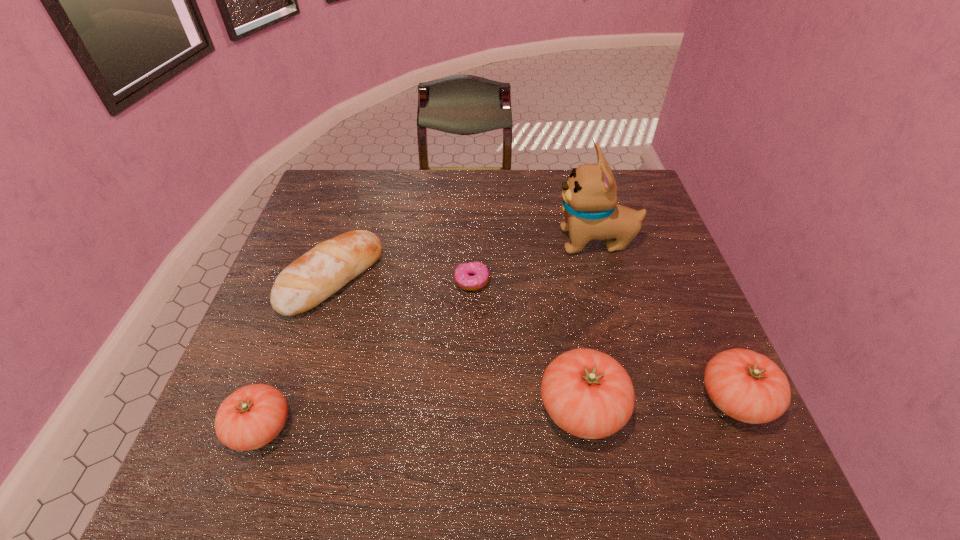
The width and height of the screenshot is (960, 540). Identify the location of the leftmost tomato. (252, 416).

In order to click on the second tomato from right to left in this screenshot , I will do `click(587, 393)`.

What are the coordinates of `the second shortest tomato` in the screenshot? It's located at (747, 386).

Where is `the rightmost object`? the rightmost object is located at coordinates (747, 386).

Where is `the shortest object`? The width and height of the screenshot is (960, 540). the shortest object is located at coordinates (462, 273).

In order to click on doughnut in this screenshot , I will do `click(462, 273)`.

Find the location of a particular element. Image resolution: width=960 pixels, height=540 pixels. bread is located at coordinates (312, 278).

Locate an element on the screen. The image size is (960, 540). the tallest object is located at coordinates (590, 207).

At what (x,y) coordinates should I click in order to perform the action: click on free region located on the right of the shortest tomato. Please return your answer as a coordinate pair (x, y). This screenshot has height=540, width=960. Looking at the image, I should click on (345, 427).

Image resolution: width=960 pixels, height=540 pixels. Identify the location of vacant region located on the right of the second tomato from left to right. (710, 408).